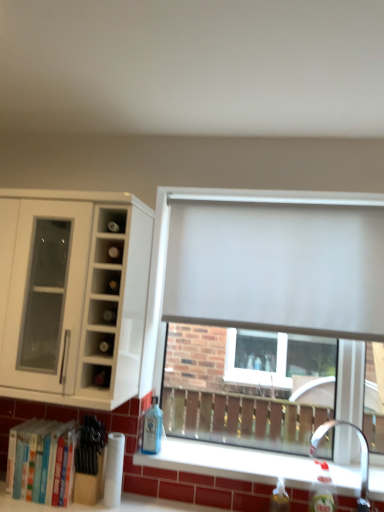
Question: Which is correct: translucent plastic bottle at lower right, which is the 2th bottle in front-to-back order, is inside blue glass bottle at lower center, the 3th bottle in the right-to-left sequence, or outside of it?

Choices:
 (A) outside
 (B) inside

Answer: (A)

Question: Relative to blue glass bottle at lower center, the first bottle viewed from the back, is translucent plastic bottle at lower right, which is the second bottle in right-to-left order, in front or behind?

Choices:
 (A) behind
 (B) front

Answer: (B)

Question: Which of these objects is positioned closest to the white matte cabinet at left?

Choices:
 (A) satin nickel faucet at lower right
 (B) blue glass bottle at lower center, the 3th bottle in the right-to-left sequence
 (C) translucent plastic bottle at lower right, the 1th bottle viewed from the front
 (D) translucent plastic bottle at lower right, which is the second bottle in right-to-left order
 (E) matte white wine rack at upper left

Answer: (E)

Question: Estimate the real-world distances between objects in this image. Which object is farther from the satin nickel faucet at lower right?

Choices:
 (A) white matte window at center
 (B) hardcover books at lower left
 (C) blue glass bottle at lower center, the 3th bottle in the right-to-left sequence
 (D) translucent plastic bottle at lower right, the third bottle positioned from the left
 (E) white matte curtain at center

Answer: (B)